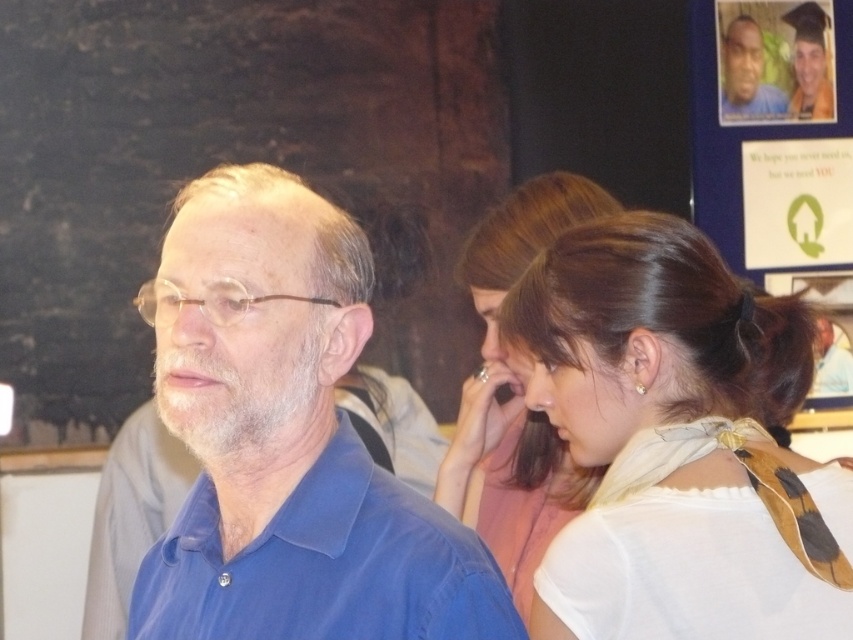
Does smooth skin face at upper right appear over gray matte hair at upper right?

Correct, smooth skin face at upper right is located above gray matte hair at upper right.

Is smooth skin face at upper right further to camera compared to gray matte hair at upper right?

Yes, it is behind gray matte hair at upper right.

At what (x,y) coordinates should I click in order to perform the action: click on smooth skin face at upper right. Please return your answer as a coordinate pair (x, y). Looking at the image, I should click on (747, 74).

Which is above, white silk scarf at center or goldearring at right?

goldearring at right is above.

Is white silk scarf at center behind goldearring at right?

Yes, it is behind goldearring at right.

Is point (485, 244) less distant than point (643, 369)?

That is False.

The width and height of the screenshot is (853, 640). I want to click on white silk scarf at center, so pyautogui.click(x=514, y=392).

From the picture: Does blue smooth shirt at center appear on the left side of goldearring at right?

Yes, blue smooth shirt at center is to the left of goldearring at right.

Who is more distant from viewer, (160, 328) or (647, 385)?

Point (647, 385)

Is point (289, 173) farther from camera compared to point (630, 388)?

Yes, point (289, 173) is behind point (630, 388).

At what (x,y) coordinates should I click in order to perform the action: click on blue smooth shirt at center. Please return your answer as a coordinate pair (x, y). The width and height of the screenshot is (853, 640). Looking at the image, I should click on (286, 440).